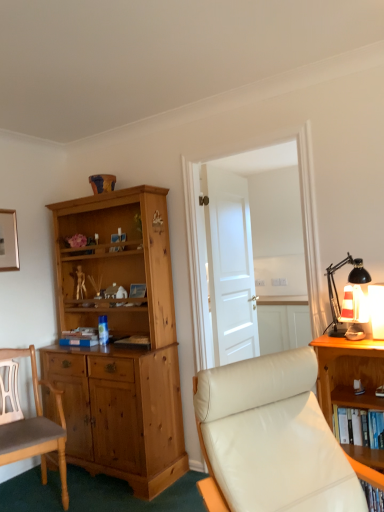
Question: From a real-world perspective, is white glossy door at center over white matte door at center?

Choices:
 (A) no
 (B) yes

Answer: (B)

Question: Considering the relative sizes of white glossy door at center and white matte door at center in the image provided, is white glossy door at center bigger than white matte door at center?

Choices:
 (A) no
 (B) yes

Answer: (A)

Question: Is white glossy door at center shorter than white matte door at center?

Choices:
 (A) yes
 (B) no

Answer: (B)

Question: Could you tell me if white glossy door at center is turned towards white matte door at center?

Choices:
 (A) no
 (B) yes

Answer: (A)

Question: Is white glossy door at center at the right side of white matte door at center?

Choices:
 (A) yes
 (B) no

Answer: (A)

Question: Considering their positions, is hardcover book at center located in front of or behind striped fabric lampshade at right?

Choices:
 (A) front
 (B) behind

Answer: (B)

Question: From the image's perspective, is hardcover book at center located above or below striped fabric lampshade at right?

Choices:
 (A) above
 (B) below

Answer: (B)

Question: Considering the positions of point (127, 339) and point (355, 320), is point (127, 339) closer or farther from the camera than point (355, 320)?

Choices:
 (A) closer
 (B) farther

Answer: (B)

Question: From a real-world perspective, relative to striped fabric lampshade at right, is hardcover book at center vertically above or below?

Choices:
 (A) below
 (B) above

Answer: (A)

Question: Considering the positions of light brown wood chair at left, acting as the second chair starting from the right, and hardcover book at center in the image, is light brown wood chair at left, acting as the second chair starting from the right, taller or shorter than hardcover book at center?

Choices:
 (A) short
 (B) tall

Answer: (B)

Question: From a real-world perspective, is light brown wood chair at left, which appears as the 1th chair when viewed from the left, above or below hardcover book at center?

Choices:
 (A) above
 (B) below

Answer: (B)

Question: Is point (3, 406) positioned closer to the camera than point (130, 339)?

Choices:
 (A) farther
 (B) closer

Answer: (B)

Question: In the image, is light brown wood chair at left, acting as the second chair starting from the front, positioned in front of or behind hardcover book at center?

Choices:
 (A) behind
 (B) front

Answer: (B)

Question: Looking at their shapes, would you say striped fabric lampshade at right is wider or thinner than white glossy door at center?

Choices:
 (A) wide
 (B) thin

Answer: (A)

Question: Considering the positions of point (350, 322) and point (317, 294), is point (350, 322) closer or farther from the camera than point (317, 294)?

Choices:
 (A) closer
 (B) farther

Answer: (A)